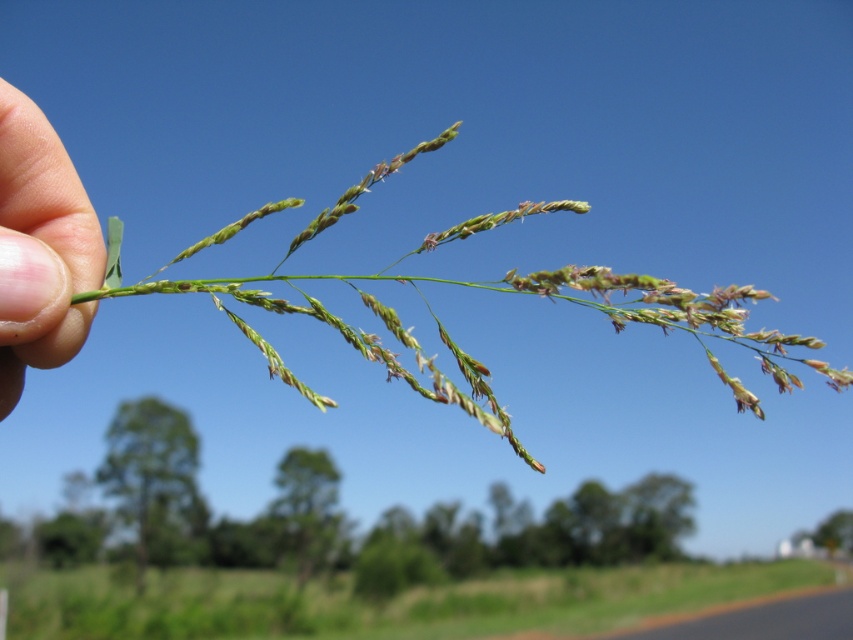
You are standing in a field and see a plant stem with elongated, spike structures in your hand. There is a point marked at coordinates [376,604]. What is located at that point?

The point at [376,604] has green leafy grass at lower center located there.